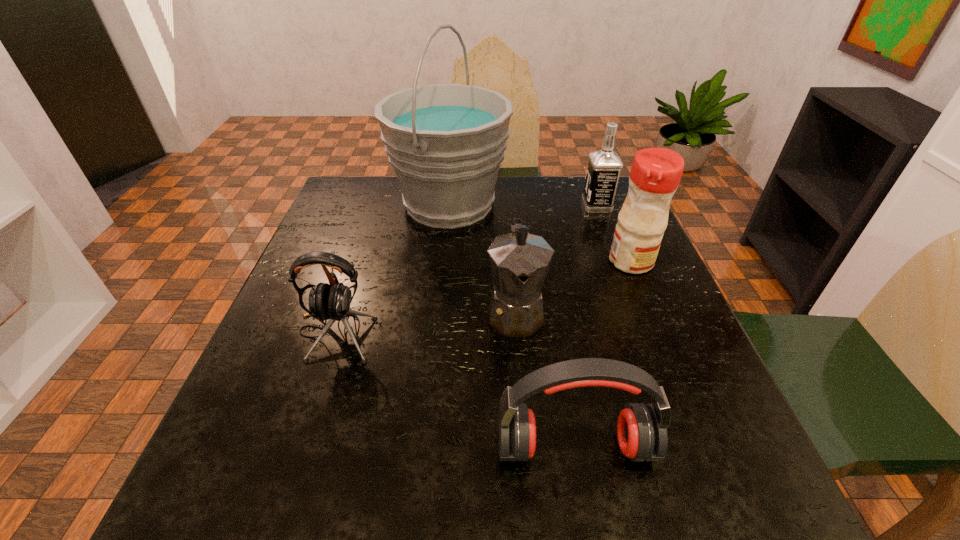
In the image, there is a desktop. In order to click on vacant space at the near right corner in this screenshot , I will do `click(719, 502)`.

The height and width of the screenshot is (540, 960). Identify the location of free space that is in between the vodka and the fifth shortest object. (613, 233).

Identify the location of free area in between the coffeepot and the farther earphone. (425, 322).

You are a GUI agent. You are given a task and a screenshot of the screen. Output one action in this format:
    pyautogui.click(x=<x>, y=<y>)
    Task: Click on the blank region between the third farthest object and the coffeepot
    Image resolution: width=960 pixels, height=540 pixels.
    Given the screenshot: What is the action you would take?
    pyautogui.click(x=573, y=287)

Locate an element on the screen. This screenshot has height=540, width=960. free space between the condiment and the farther earphone is located at coordinates (483, 297).

Image resolution: width=960 pixels, height=540 pixels. Identify the location of free space between the nearer earphone and the left earphone. (455, 390).

Where is `blank region between the farther earphone and the nearer earphone`? The width and height of the screenshot is (960, 540). blank region between the farther earphone and the nearer earphone is located at coordinates (455, 390).

Where is `unoccupied position between the coffeepot and the bucket`? The image size is (960, 540). unoccupied position between the coffeepot and the bucket is located at coordinates (482, 258).

Identify the location of vacant area between the condiment and the vodka. The height and width of the screenshot is (540, 960). (613, 233).

Image resolution: width=960 pixels, height=540 pixels. In order to click on free space between the nearer earphone and the vodka in this screenshot , I will do `click(586, 326)`.